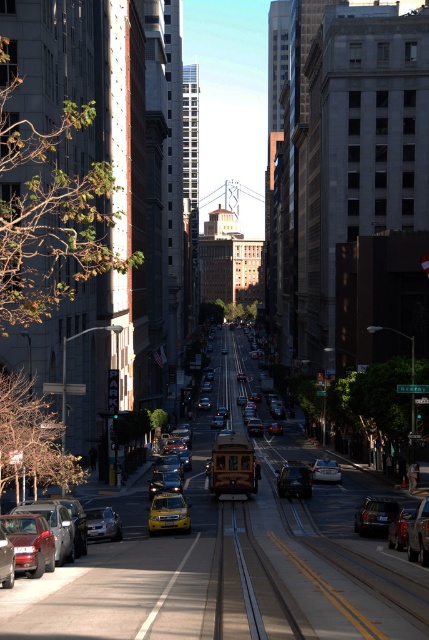
Question: Among these points, which one is farthest from the camera?

Choices:
 (A) (112, 515)
 (B) (399, 528)
 (C) (11, 563)

Answer: (A)

Question: Which of the following is the farthest from the observer?

Choices:
 (A) matte red car at lower left
 (B) metallic silver taxi at center

Answer: (A)

Question: From the image, what is the correct spatial relationship of shiny red sedan at lower left in relation to matte silver sedan at center?

Choices:
 (A) right
 (B) left

Answer: (B)

Question: Does matte red car at lower left have a smaller size compared to metallic silver car at lower right?

Choices:
 (A) no
 (B) yes

Answer: (A)

Question: Is matte red car at lower left thinner than yellow matte taxi at lower center?

Choices:
 (A) no
 (B) yes

Answer: (A)

Question: Which of the following is the farthest from the observer?

Choices:
 (A) (75, 520)
 (B) (283, 490)
 (C) (363, 509)

Answer: (B)